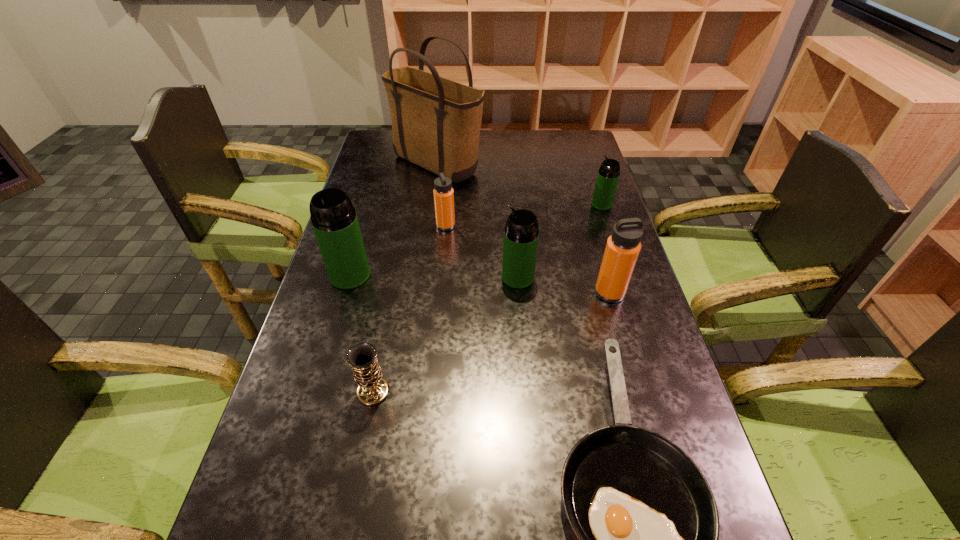
This screenshot has height=540, width=960. In order to click on the tallest object in this screenshot , I will do `click(436, 122)`.

At what (x,y) coordinates should I click in order to perform the action: click on tote bag. Please return your answer as a coordinate pair (x, y). The image size is (960, 540). Looking at the image, I should click on (436, 122).

Identify the location of the leftmost green thermos bottle. (334, 220).

You are a GUI agent. You are given a task and a screenshot of the screen. Output one action in this format:
    pyautogui.click(x=<x>, y=<y>)
    Task: Click on the biggest green thermos bottle
    
    Given the screenshot: What is the action you would take?
    [x=334, y=220]

Where is `the third thermos bottle from right to left`? the third thermos bottle from right to left is located at coordinates (521, 233).

Where is `the second green thermos bottle from left to right`? the second green thermos bottle from left to right is located at coordinates (521, 233).

Locate an element on the screen. This screenshot has height=540, width=960. the nearer orange thermos bottle is located at coordinates (623, 247).

The height and width of the screenshot is (540, 960). Find the location of `the bigger orange thermos bottle`. the bigger orange thermos bottle is located at coordinates pos(623,247).

You are a GUI agent. You are given a task and a screenshot of the screen. Output one action in this format:
    pyautogui.click(x=<x>, y=<y>)
    Task: Click on the rightmost green thermos bottle
    This screenshot has height=540, width=960.
    Given the screenshot: What is the action you would take?
    pyautogui.click(x=608, y=175)

Identify the location of the farthest green thermos bottle. This screenshot has width=960, height=540. (608, 175).